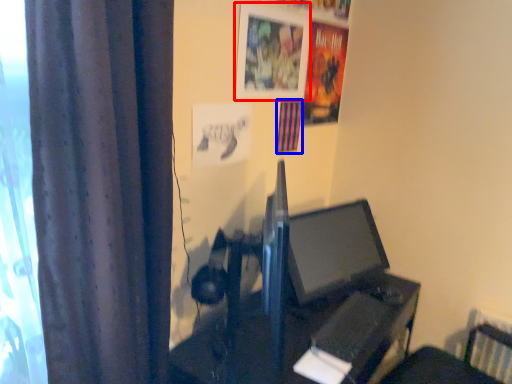
Question: Which object is further to the camera taking this photo, picture frame (highlighted by a red box) or poster page (highlighted by a blue box)?

Choices:
 (A) picture frame
 (B) poster page

Answer: (B)